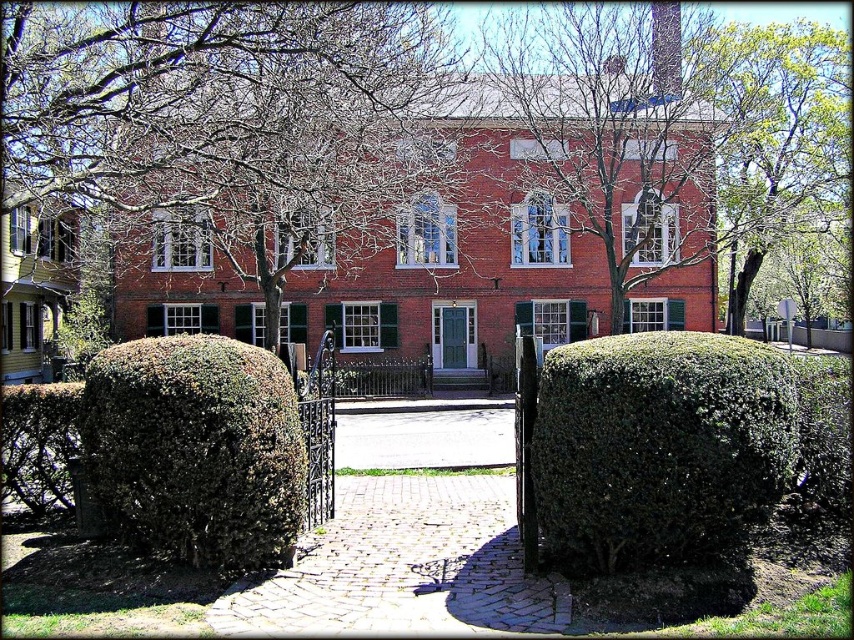
You are standing at the entrance of the large, red brick building and want to find the green leafy tree at upper right. According to the scene description, where should you look relative to your position?

The green leafy tree at upper right is located at point 0.216 on the horizontal axis and 0.909 on the vertical axis, so you should look towards the upper right direction from your position at the entrance.

You are a landscape architect designing a garden path between the green leafy bush at center and the green leafy tree at upper right. Which object requires more space in terms of width for proper placement?

The green leafy tree at upper right requires more space in terms of width because its width is greater than the green leafy bush at center.

You are standing at the entrance of the large red brick building and want to walk towards the ornate black wrought iron gates. Which point, point (214, 381) or point (732, 330), is closer to the gates?

Point (214, 381) is closer to the ornate black wrought iron gates because it is in front of point (732, 330).